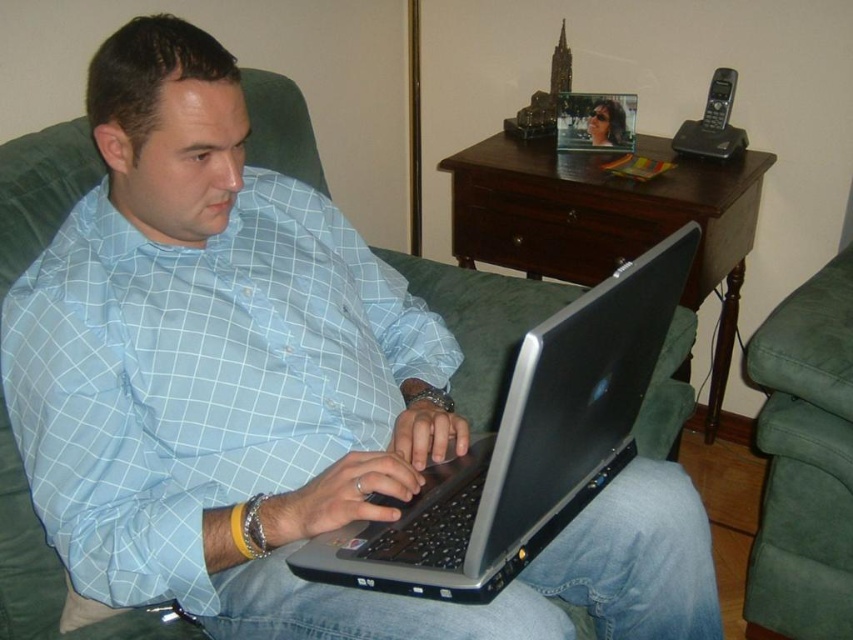
Question: Among these objects, which one is farthest from the camera?

Choices:
 (A) light blue checkered shirt at center
 (B) silver metallic laptop at center

Answer: (A)

Question: Which point appears closest to the camera in this image?

Choices:
 (A) 135,410
 (B) 587,308

Answer: (B)

Question: Is light blue checkered shirt at center above silver metallic laptop at center?

Choices:
 (A) no
 (B) yes

Answer: (B)

Question: Is light blue checkered shirt at center smaller than silver metallic laptop at center?

Choices:
 (A) yes
 (B) no

Answer: (B)

Question: Is light blue checkered shirt at center to the right of silver metallic laptop at center from the viewer's perspective?

Choices:
 (A) no
 (B) yes

Answer: (A)